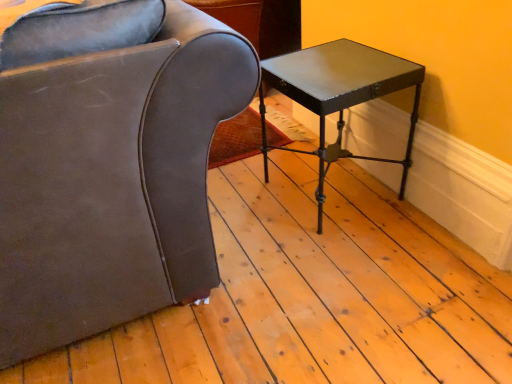
Identify the location of free space between brown leather chair at left and glossy black table at right. (269, 192).